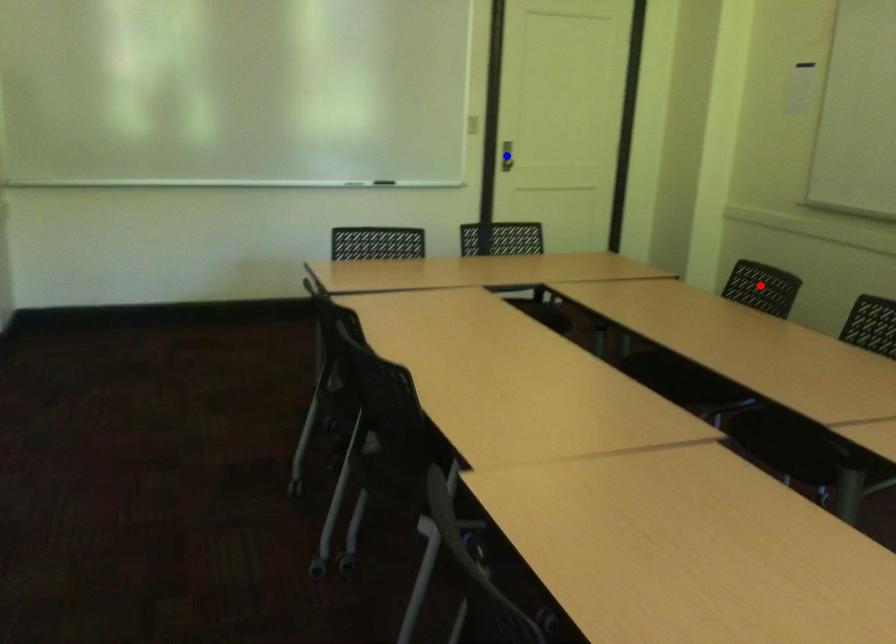
Question: Two points are marked on the image. Which point is closer to the camera?

Choices:
 (A) Blue point is closer.
 (B) Red point is closer.

Answer: (B)